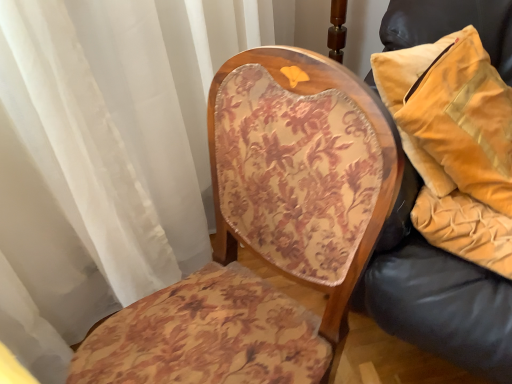
Question: Considering the relative sizes of floral-patterned fabric chair at center and velvet yellow pillow at right in the image provided, is floral-patterned fabric chair at center thinner than velvet yellow pillow at right?

Choices:
 (A) yes
 (B) no

Answer: (B)

Question: Considering the relative sizes of floral-patterned fabric chair at center and velvet yellow pillow at right in the image provided, is floral-patterned fabric chair at center shorter than velvet yellow pillow at right?

Choices:
 (A) yes
 (B) no

Answer: (B)

Question: Is floral-patterned fabric chair at center behind velvet yellow pillow at right?

Choices:
 (A) yes
 (B) no

Answer: (B)

Question: Is floral-patterned fabric chair at center turned away from velvet yellow pillow at right?

Choices:
 (A) yes
 (B) no

Answer: (A)

Question: Would you consider floral-patterned fabric chair at center to be distant from velvet yellow pillow at right?

Choices:
 (A) no
 (B) yes

Answer: (A)

Question: Considering the positions of velvet/yellow pillow at right and velvet yellow pillow at right in the image, is velvet/yellow pillow at right wider or thinner than velvet yellow pillow at right?

Choices:
 (A) thin
 (B) wide

Answer: (B)

Question: Is velvet/yellow pillow at right situated inside velvet yellow pillow at right or outside?

Choices:
 (A) inside
 (B) outside

Answer: (A)

Question: Considering the relative positions of velvet/yellow pillow at right and velvet yellow pillow at right in the image provided, is velvet/yellow pillow at right to the left or to the right of velvet yellow pillow at right?

Choices:
 (A) left
 (B) right

Answer: (A)

Question: From the image's perspective, is velvet/yellow pillow at right positioned above or below velvet yellow pillow at right?

Choices:
 (A) above
 (B) below

Answer: (A)

Question: In the image, is velvet yellow pillow at right on the left side or the right side of floral-patterned fabric chair at center?

Choices:
 (A) left
 (B) right

Answer: (B)

Question: In the image, is velvet yellow pillow at right positioned in front of or behind floral-patterned fabric chair at center?

Choices:
 (A) behind
 (B) front

Answer: (A)

Question: Would you say velvet yellow pillow at right is inside or outside floral-patterned fabric chair at center?

Choices:
 (A) inside
 (B) outside

Answer: (B)

Question: Is point (384, 29) closer or farther from the camera than point (242, 139)?

Choices:
 (A) farther
 (B) closer

Answer: (A)

Question: From their relative heights in the image, would you say velvet/yellow pillow at right is taller or shorter than floral-patterned fabric chair at center?

Choices:
 (A) tall
 (B) short

Answer: (B)

Question: Looking at the image, does velvet/yellow pillow at right seem bigger or smaller compared to floral-patterned fabric chair at center?

Choices:
 (A) big
 (B) small

Answer: (B)